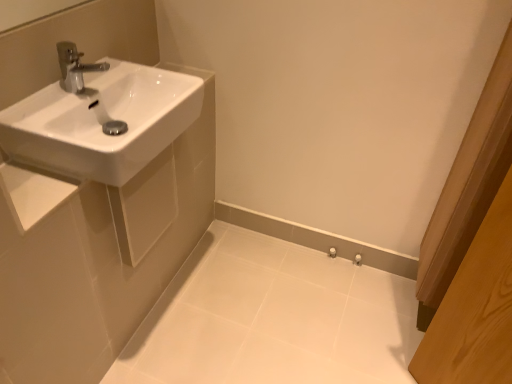
Question: Should I look upward or downward to see white glossy porcelain at lower center?

Choices:
 (A) up
 (B) down

Answer: (B)

Question: Is the depth of white glossy porcelain at lower center greater than that of white glossy sink at upper left?

Choices:
 (A) no
 (B) yes

Answer: (B)

Question: Considering the relative sizes of white glossy porcelain at lower center and white glossy sink at upper left in the image provided, is white glossy porcelain at lower center thinner than white glossy sink at upper left?

Choices:
 (A) yes
 (B) no

Answer: (B)

Question: Is white glossy porcelain at lower center to the left of white glossy sink at upper left from the viewer's perspective?

Choices:
 (A) no
 (B) yes

Answer: (A)

Question: Is white glossy porcelain at lower center positioned with its back to white glossy sink at upper left?

Choices:
 (A) no
 (B) yes

Answer: (A)

Question: Is white glossy porcelain at lower center to the right of white glossy sink at upper left from the viewer's perspective?

Choices:
 (A) no
 (B) yes

Answer: (B)

Question: Is white glossy porcelain at lower center outside white glossy sink at upper left?

Choices:
 (A) no
 (B) yes

Answer: (B)

Question: Does white glossy porcelain at lower center have a larger size compared to white glossy sink at left?

Choices:
 (A) no
 (B) yes

Answer: (B)

Question: From a real-world perspective, does white glossy porcelain at lower center stand above white glossy sink at left?

Choices:
 (A) no
 (B) yes

Answer: (A)

Question: From a real-world perspective, is white glossy porcelain at lower center physically below white glossy sink at left?

Choices:
 (A) no
 (B) yes

Answer: (B)

Question: Does white glossy porcelain at lower center have a greater width compared to white glossy sink at left?

Choices:
 (A) no
 (B) yes

Answer: (B)

Question: Can you confirm if white glossy porcelain at lower center is taller than white glossy sink at left?

Choices:
 (A) no
 (B) yes

Answer: (A)

Question: Is white glossy porcelain at lower center oriented away from white glossy sink at left?

Choices:
 (A) yes
 (B) no

Answer: (B)

Question: Does white glossy sink at left have a greater height compared to white glossy porcelain at lower center?

Choices:
 (A) yes
 (B) no

Answer: (A)